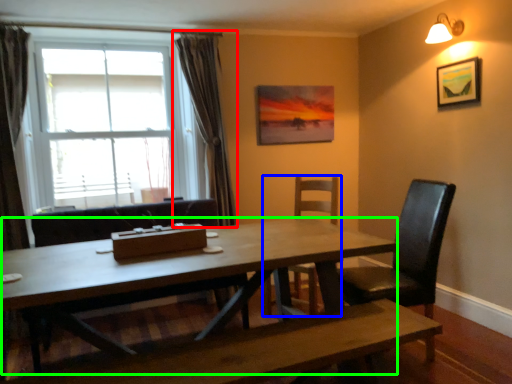
Question: Considering the real-world distances, which object is farthest from curtain (highlighted by a red box)? chair (highlighted by a blue box) or kitchen & dining room table (highlighted by a green box)?

Choices:
 (A) chair
 (B) kitchen & dining room table

Answer: (B)